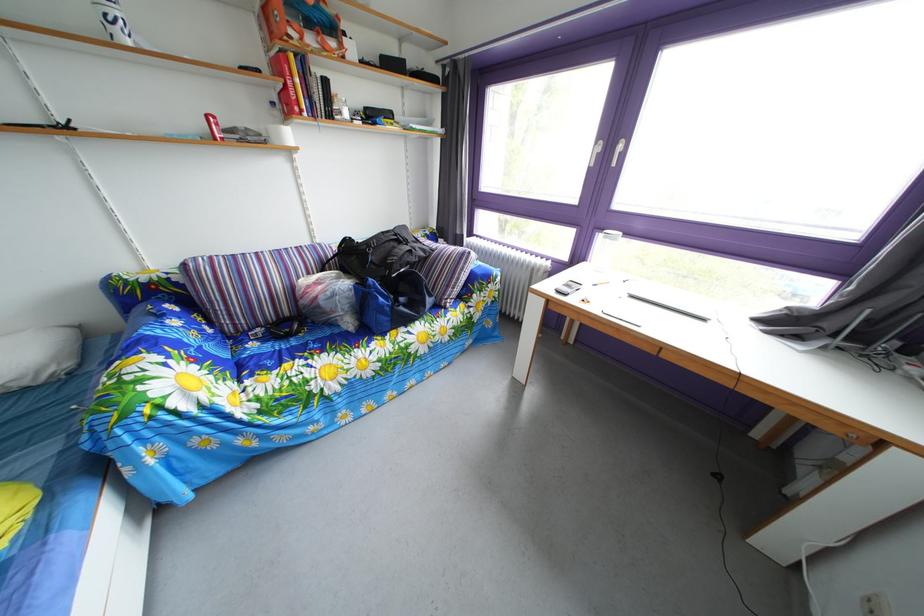
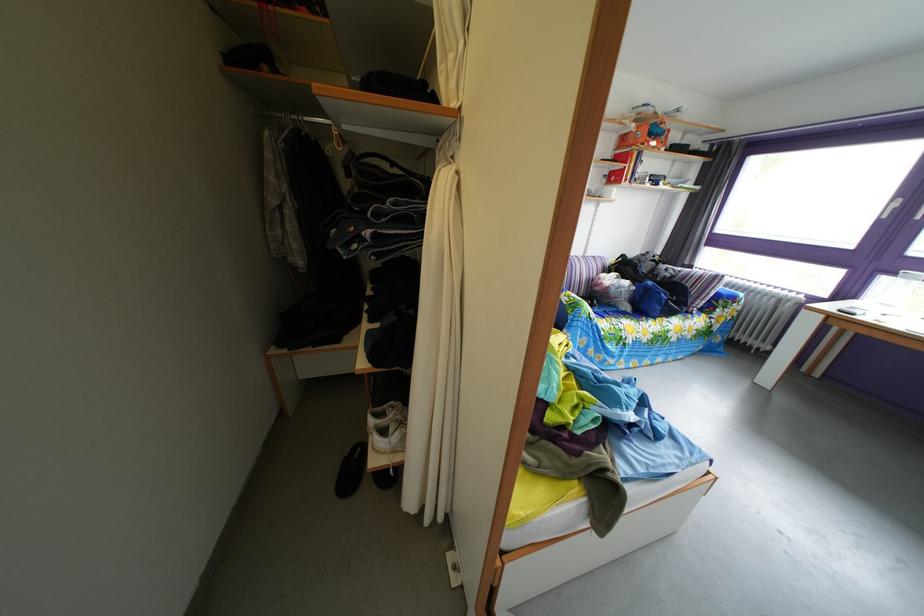
Question: I am providing you with two images of the same scene from different viewpoints. Please identify which objects are invisible in image2.

Choices:
 (A) orange box
 (B) white book binder
 (C) yellow clothes hanger
 (D) glass carafe

Answer: (D)